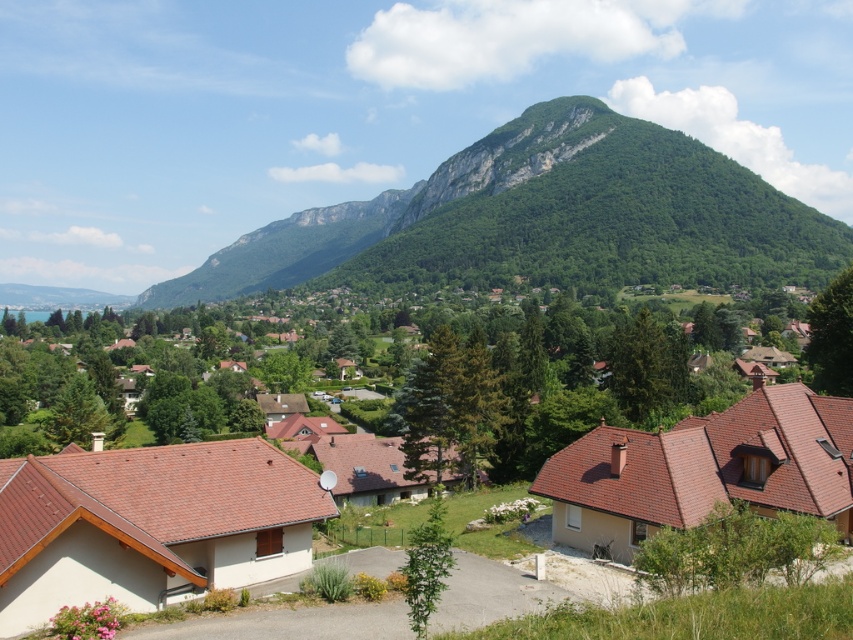
Which of these two, green forested mountain at upper center or brown tiled houses at center, stands taller?

green forested mountain at upper center is taller.

Which is below, green forested mountain at upper center or brown tiled houses at center?

brown tiled houses at center is lower down.

The image size is (853, 640). What do you see at coordinates (543, 218) in the screenshot?
I see `green forested mountain at upper center` at bounding box center [543, 218].

This screenshot has width=853, height=640. Find the location of `green forested mountain at upper center`. green forested mountain at upper center is located at coordinates (543, 218).